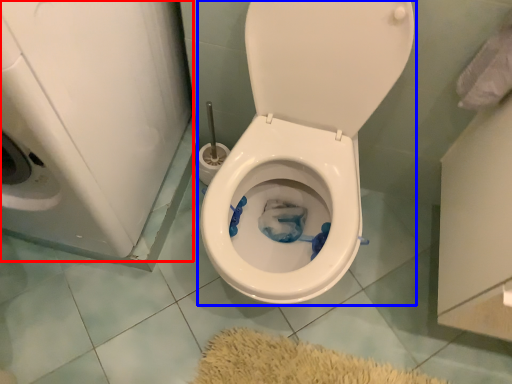
Question: Which point is further to the camera, washer (highlighted by a red box) or toilet (highlighted by a blue box)?

Choices:
 (A) washer
 (B) toilet

Answer: (B)